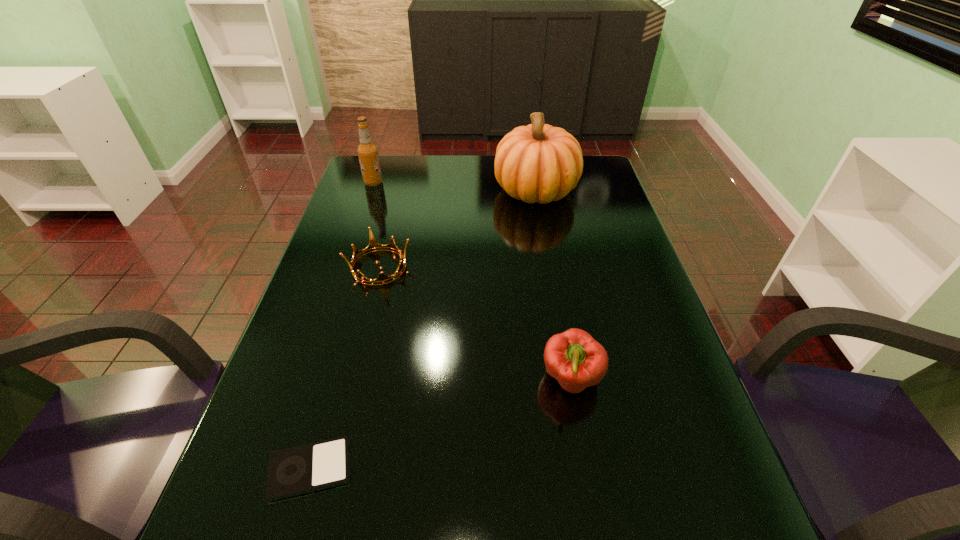
You are a GUI agent. You are given a task and a screenshot of the screen. Output one action in this format:
    pyautogui.click(x=<x>, y=<y>)
    Task: Click on the pumpkin
    The width and height of the screenshot is (960, 540).
    Given the screenshot: What is the action you would take?
    pyautogui.click(x=540, y=163)

Find the location of a particular element. The height and width of the screenshot is (540, 960). beer bottle is located at coordinates (367, 151).

Locate an element on the screen. The image size is (960, 540). the fourth farthest object is located at coordinates (577, 361).

Identify the location of the third tallest object. (577, 361).

This screenshot has width=960, height=540. Find the location of `the fourth tallest object`. the fourth tallest object is located at coordinates (373, 245).

At what (x,y) coordinates should I click in order to perform the action: click on the third farthest object. Please return your answer as a coordinate pair (x, y). The height and width of the screenshot is (540, 960). Looking at the image, I should click on (373, 245).

At what (x,y) coordinates should I click in order to perform the action: click on the nearest object. Please return your answer as a coordinate pair (x, y). Looking at the image, I should click on (298, 470).

The height and width of the screenshot is (540, 960). I want to click on the shortest object, so click(298, 470).

Image resolution: width=960 pixels, height=540 pixels. Find the location of `free space located 0.350m on the front of the pumpkin`. free space located 0.350m on the front of the pumpkin is located at coordinates click(x=554, y=295).

Identify the location of vacant area situated on the front label of the beer bottle. (489, 183).